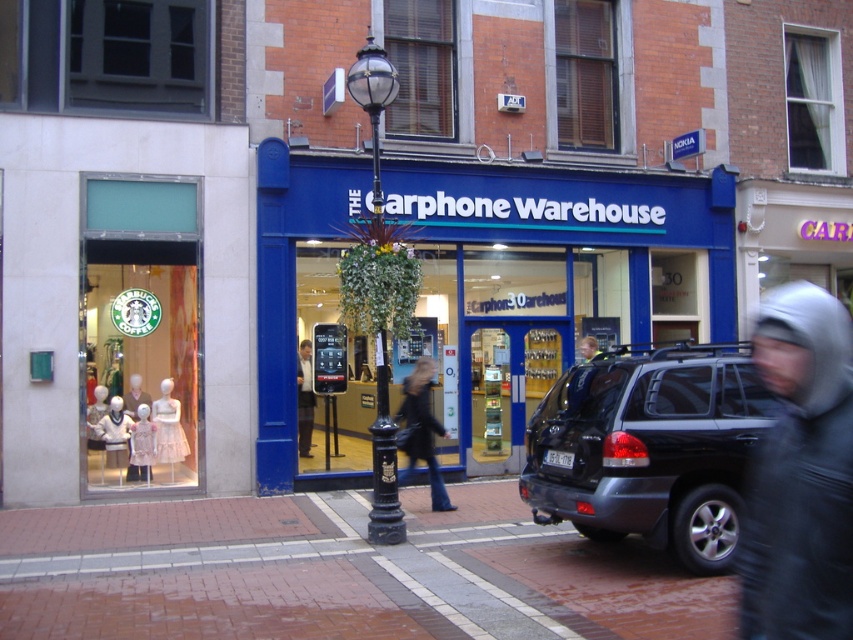
Question: Observing the image, what is the correct spatial positioning of matte white dress at center in reference to matte black phone at center?

Choices:
 (A) right
 (B) left

Answer: (B)

Question: Considering the relative positions of dark gray suv at right and white cotton dress at center in the image provided, where is dark gray suv at right located with respect to white cotton dress at center?

Choices:
 (A) below
 (B) above

Answer: (B)

Question: Based on their relative distances, which object is farther from the white cotton dress at center?

Choices:
 (A) matte white dress at center
 (B) black leather jacket at center

Answer: (B)

Question: Does brick pavement at lower center appear on the right side of matte black phone at center?

Choices:
 (A) yes
 (B) no

Answer: (A)

Question: Which point is farther from the camera taking this photo?

Choices:
 (A) (821, 307)
 (B) (106, 426)
 (C) (434, 476)
 (D) (160, 412)

Answer: (D)

Question: Which of the following is the farthest from the observer?

Choices:
 (A) (x=56, y=618)
 (B) (x=300, y=352)
 (C) (x=161, y=422)
 (D) (x=787, y=608)

Answer: (B)